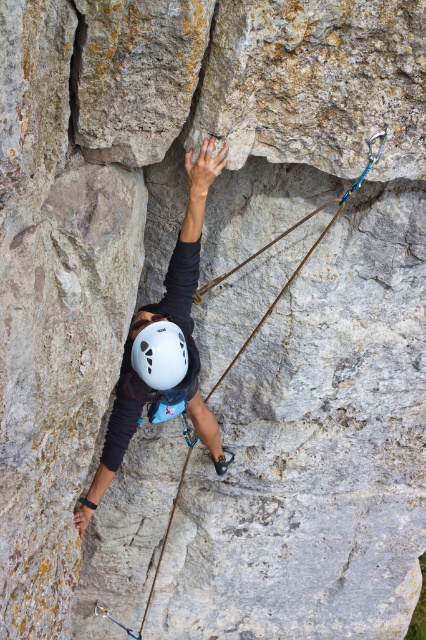
Who is lower down, brown rope at center or white matte helmet at center?

Positioned lower is white matte helmet at center.

Based on the photo, does brown rope at center have a lesser height compared to white matte helmet at center?

No.

Who is more forward, [244,260] or [149,381]?

Point [149,381] is more forward.

This screenshot has height=640, width=426. I want to click on brown rope at center, so click(301, 260).

Is matte white helmet at upper center shorter than brown rope at center?

Incorrect, matte white helmet at upper center's height does not fall short of brown rope at center's.

Where is `matte white helmet at upper center`? The image size is (426, 640). matte white helmet at upper center is located at coordinates 180,339.

The height and width of the screenshot is (640, 426). What are the coordinates of `matte white helmet at upper center` in the screenshot? It's located at (180, 339).

Describe the element at coordinates (180, 339) in the screenshot. I see `matte white helmet at upper center` at that location.

Does matte white helmet at upper center come behind white matte helmet at center?

No.

Is point (123, 440) less distant than point (138, 342)?

No, (123, 440) is further to viewer.

You are a GUI agent. You are given a task and a screenshot of the screen. Output one action in this format:
    pyautogui.click(x=<x>, y=<y>)
    Task: Click on the matte white helmet at upper center
    
    Given the screenshot: What is the action you would take?
    pyautogui.click(x=180, y=339)